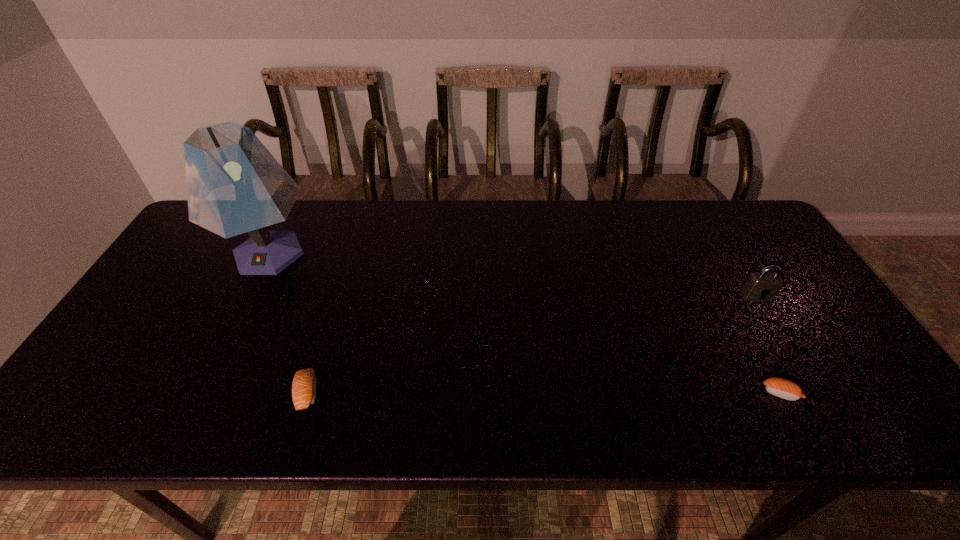
Locate an element on the screen. This screenshot has width=960, height=540. object present at the far edge is located at coordinates (234, 184).

The image size is (960, 540). I want to click on object at the left edge, so click(234, 184).

Locate an element on the screen. The width and height of the screenshot is (960, 540). object located in the right edge section of the desktop is located at coordinates (762, 286).

In order to click on object positioned at the far left corner in this screenshot , I will do `click(234, 184)`.

Locate an element on the screen. The width and height of the screenshot is (960, 540). vacant space at the far edge is located at coordinates (282, 229).

Where is `blank space at the left edge`? blank space at the left edge is located at coordinates (209, 276).

This screenshot has height=540, width=960. In order to click on vacant space at the right edge in this screenshot , I will do `click(815, 341)`.

Image resolution: width=960 pixels, height=540 pixels. In order to click on free space at the far right corner in this screenshot , I will do `click(745, 202)`.

Image resolution: width=960 pixels, height=540 pixels. In order to click on vacant area between the leftmost object and the third nearest object in this screenshot , I will do `click(513, 275)`.

Identify the location of vacant point located between the left sushi and the padlock. (532, 344).